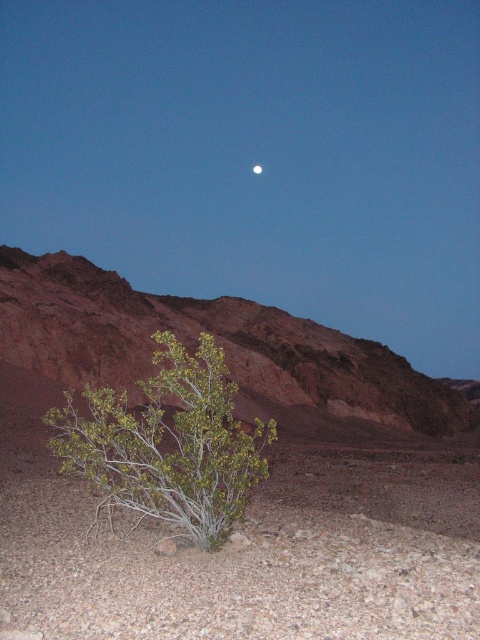
Is green leafy bush at lower center further to camera compared to green leafy shrub at lower left?

Yes, it is.

Consider the image. Does green leafy bush at lower center appear over green leafy shrub at lower left?

Yes, green leafy bush at lower center is above green leafy shrub at lower left.

Based on the photo, measure the distance between point [360,218] and camera.

They are 226.79 meters apart.

You are a GUI agent. You are given a task and a screenshot of the screen. Output one action in this format:
    pyautogui.click(x=<x>, y=<y>)
    Task: Click on the green leafy bush at lower center
    Image resolution: width=480 pixels, height=640 pixels.
    Given the screenshot: What is the action you would take?
    pyautogui.click(x=257, y=156)

Does green leafy shrub at lower left have a greater height compared to silvery reflective moon at upper center?

In fact, green leafy shrub at lower left may be shorter than silvery reflective moon at upper center.

Who is shorter, green leafy shrub at lower left or silvery reflective moon at upper center?

green leafy shrub at lower left

Is point (188, 456) positioned in front of point (260, 170)?

Yes, it is in front of point (260, 170).

You are a GUI agent. You are given a task and a screenshot of the screen. Output one action in this format:
    pyautogui.click(x=<x>, y=<y>)
    Task: Click on the green leafy shrub at lower left
    This screenshot has width=480, height=640.
    Given the screenshot: What is the action you would take?
    pyautogui.click(x=168, y=444)

Does green leafy bush at lower center have a larger size compared to silvery reflective moon at upper center?

Yes.

Does point (84, 145) come behind point (257, 170)?

Yes, point (84, 145) is behind point (257, 170).

Is point (137, 230) positioned in front of point (255, 172)?

No, it is not.

Where is `green leafy bush at lower center`? The image size is (480, 640). green leafy bush at lower center is located at coordinates (257, 156).